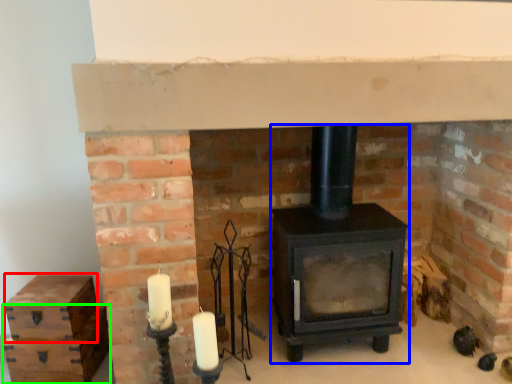
Question: Which object is positioned closest to drawer (highlighted by a red box)? Select from wood burning stove (highlighted by a blue box) and drawer (highlighted by a green box).

Choices:
 (A) wood burning stove
 (B) drawer

Answer: (B)